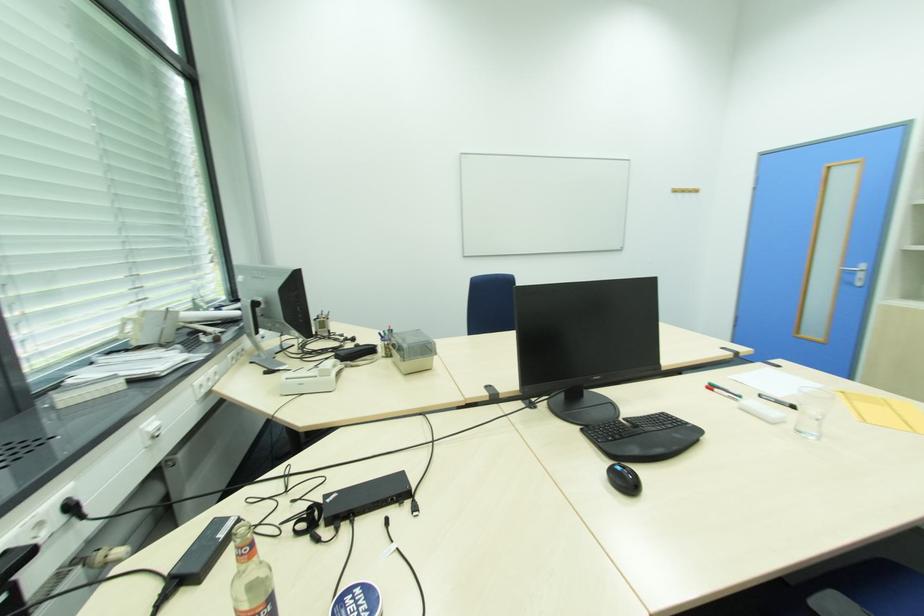
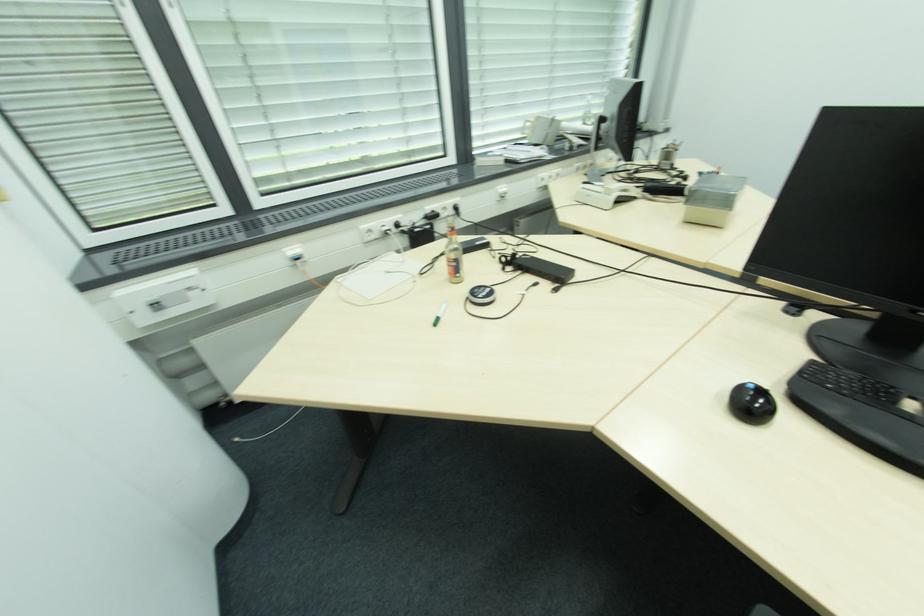
In the second image, find the point that corresponds to point 621,468 in the first image.

(755, 387)